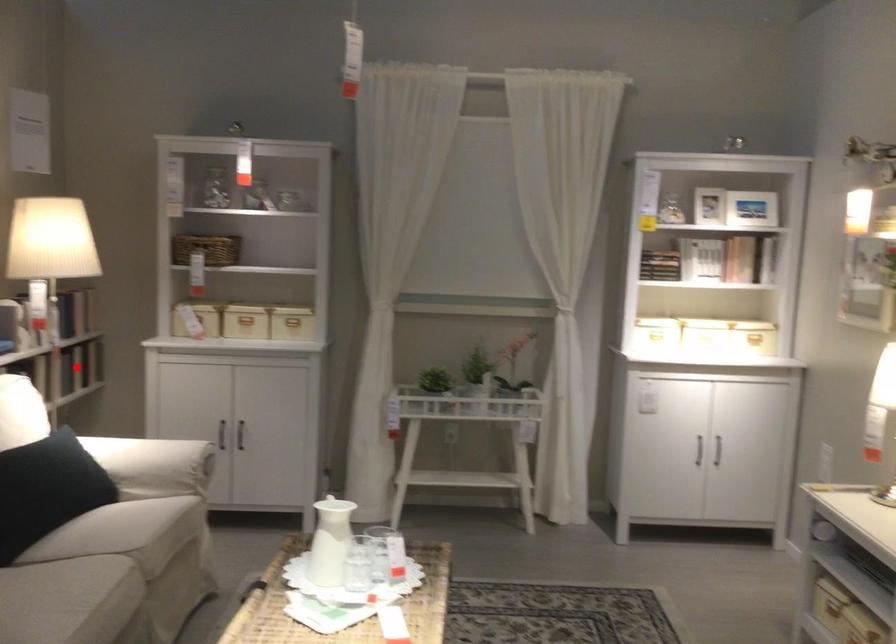
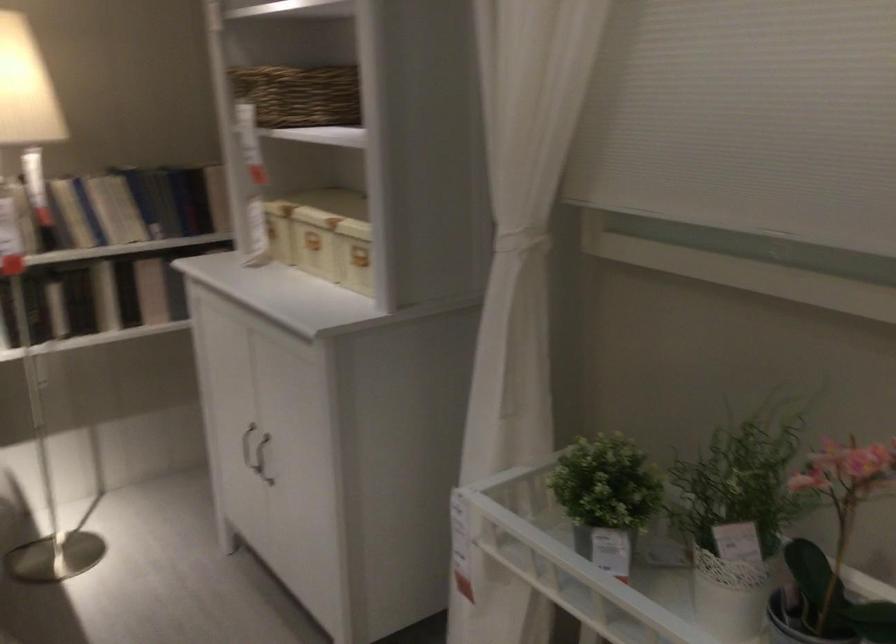
In the second image, find the point that corresponds to the highlighted location in the first image.

(151, 290)